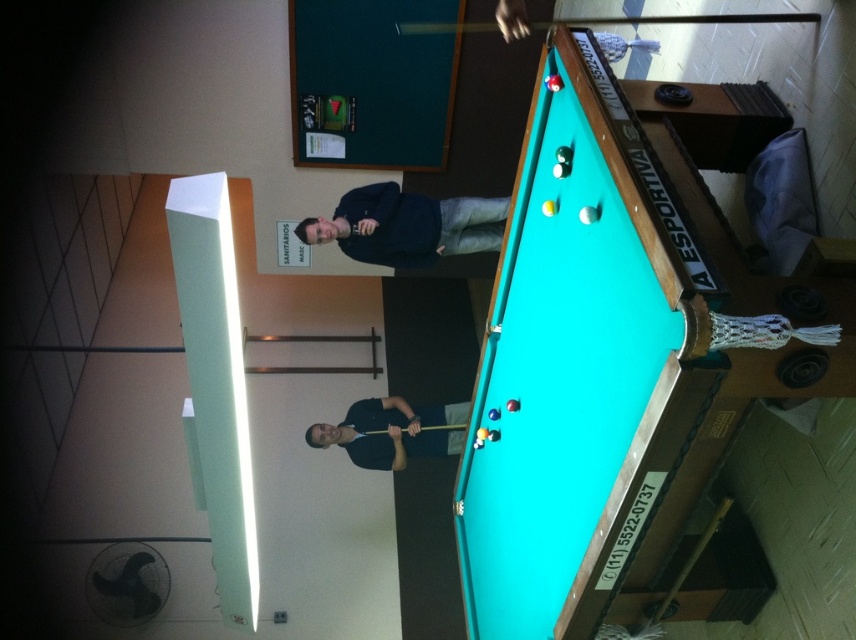
You are a pool player who wants to place a 1.5 meter long pool cue on the teal felt pool table at upper right. However, there is a dark blue shirt at center nearby. Can you place the pool cue horizontally on the table without it touching the shirt?

The teal felt pool table at upper right and dark blue shirt at center are 1.79 meters apart. Since the pool cue is 1.5 meters long, placing it horizontally on the table would leave enough space between the table and the shirt, so yes, it can be placed without touching the shirt.

You are a spectator standing at the back of the room and want to take a photo of the teal felt pool table at upper right and the dark blue shirt at center. Which object should you focus on first to ensure both are in focus?

You should focus on the teal felt pool table at upper right first because it is closer to you than the dark blue shirt at center, so adjusting focus starting from the closer object ensures both are in focus.

You are standing at the center of the room where the teal felt pool table at upper right is located. You want to place a new decorative item exactly at the point marked by the coordinates point (607, 360). Where on the teal felt pool table at upper right should you place it?

The point (607, 360) indicates the location on the teal felt pool table at upper right where the decorative item should be placed.